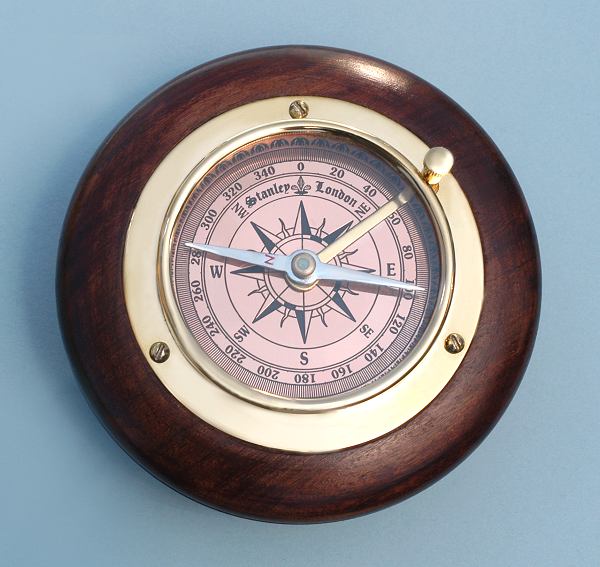
Identify the location of wall. The width and height of the screenshot is (600, 567). (34, 146).